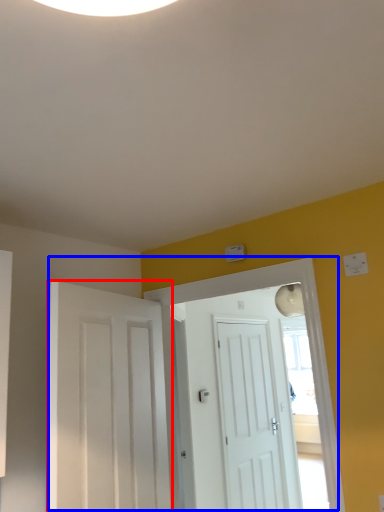
Question: Among these objects, which one is nearest to the camera, door (highlighted by a red box) or door (highlighted by a blue box)?

Choices:
 (A) door
 (B) door

Answer: (A)